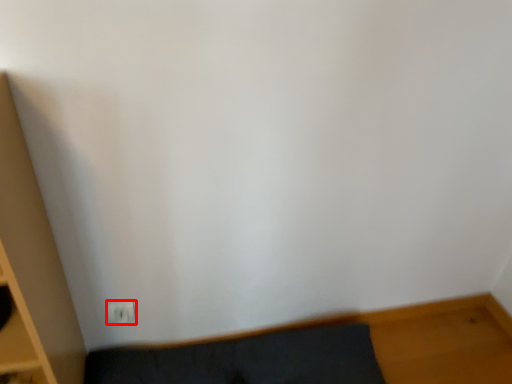
Question: From the image's perspective, where is electric outlet (annotated by the red box) located in relation to furniture in the image?

Choices:
 (A) below
 (B) above

Answer: (B)